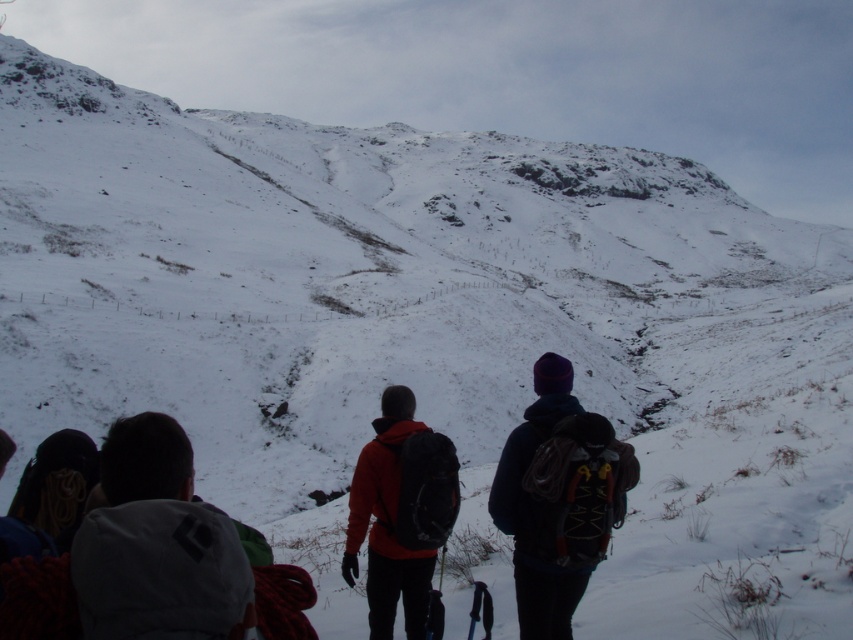
Question: Is dark blue fleece jacket at center thinner than matte orange jacket at center?

Choices:
 (A) no
 (B) yes

Answer: (A)

Question: Which point is closer to the camera?

Choices:
 (A) dark blue fleece jacket at center
 (B) matte orange jacket at center

Answer: (A)

Question: Among these objects, which one is nearest to the camera?

Choices:
 (A) white fleece jacket at lower left
 (B) matte orange jacket at center

Answer: (A)

Question: Is dark blue fleece jacket at center closer to camera compared to matte orange jacket at center?

Choices:
 (A) no
 (B) yes

Answer: (B)

Question: Is white fleece jacket at lower left above matte orange jacket at center?

Choices:
 (A) yes
 (B) no

Answer: (A)

Question: Which is nearer to the dark blue fleece jacket at center?

Choices:
 (A) matte orange jacket at center
 (B) white fleece jacket at lower left

Answer: (A)